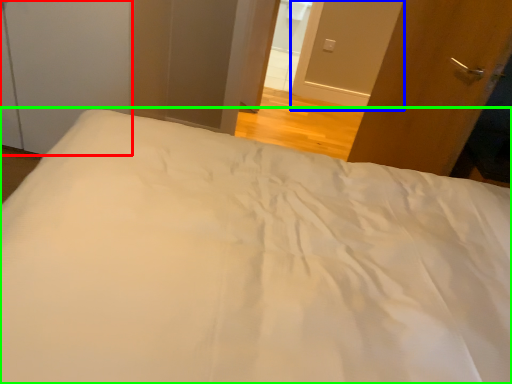
Question: Estimate the real-world distances between objects in this image. Which object is farther from screen door (highlighted by a red box), screen door (highlighted by a blue box) or bed (highlighted by a green box)?

Choices:
 (A) screen door
 (B) bed

Answer: (A)